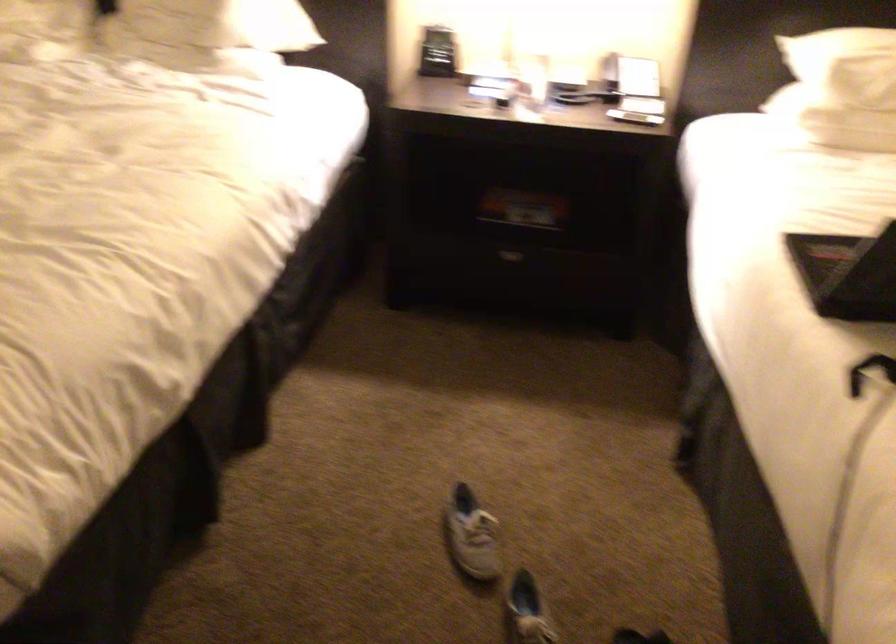
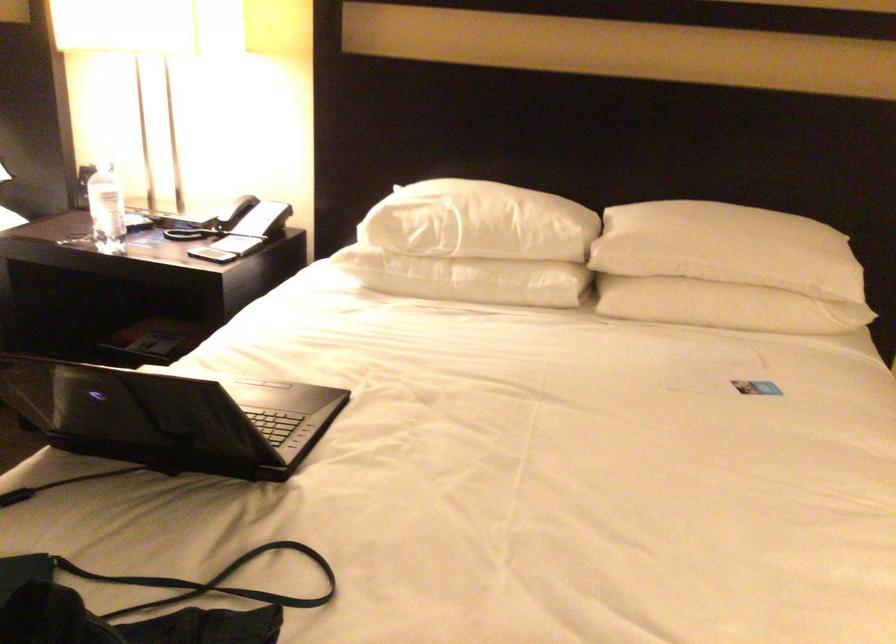
The point at (621, 71) is marked in the first image. Where is the corresponding point in the second image?

(238, 221)